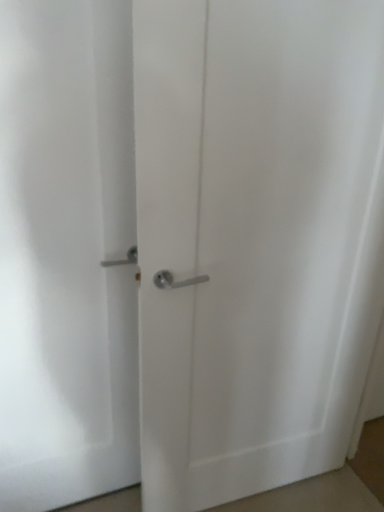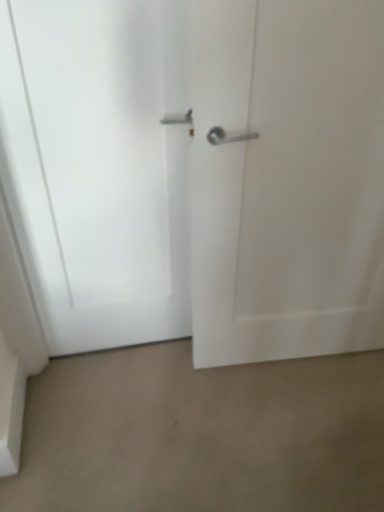
Question: Which way did the camera rotate in the video?

Choices:
 (A) rotated upward
 (B) rotated downward

Answer: (B)